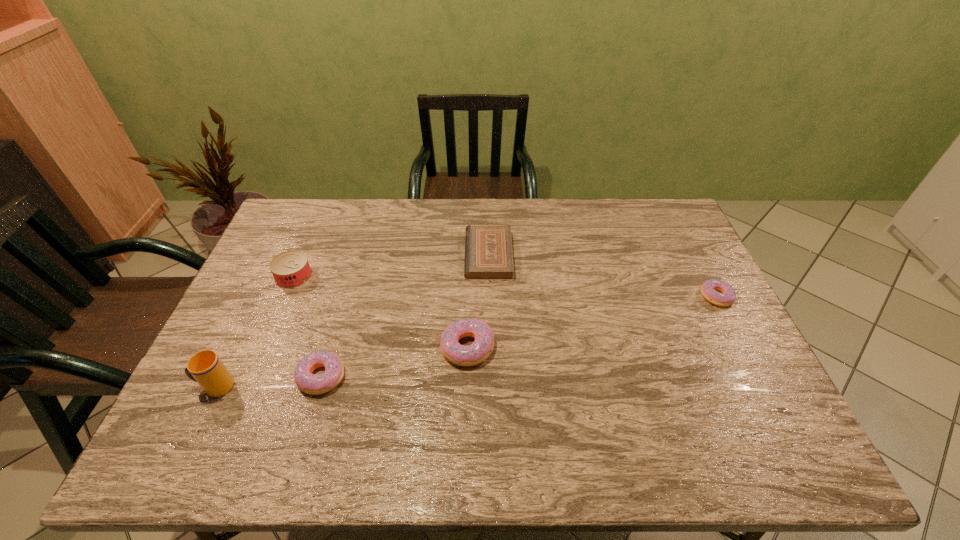
At what (x,y) coordinates should I click in order to perform the action: click on free spot between the can and the Bible. Please return your answer as a coordinate pair (x, y). Looking at the image, I should click on (392, 266).

I want to click on free space between the can and the rightmost object, so click(505, 286).

Identify the location of free area in between the tallest doughnut and the can. The height and width of the screenshot is (540, 960). click(x=381, y=312).

At what (x,y) coordinates should I click in order to perform the action: click on free point between the fourth object from right to left and the second doughnut from left to right. Please return your answer as a coordinate pair (x, y). This screenshot has width=960, height=540. Looking at the image, I should click on (395, 362).

Identify the location of unoccupied position between the tallest doughnut and the can. (381, 312).

Identify the location of unoccupied position between the Bible and the can. (392, 266).

This screenshot has height=540, width=960. In order to click on free space between the rightmost doughnut and the Bible in this screenshot , I will do `click(602, 276)`.

Where is `vacant area that lies between the second doughnut from left to right and the shortest doughnut`? vacant area that lies between the second doughnut from left to right and the shortest doughnut is located at coordinates (592, 322).

Point out which object is positioned as the nearest to the cup. Please provide its 2D coordinates. Your answer should be formatted as a tuple, i.e. [(x, y)], where the tuple contains the x and y coordinates of a point satisfying the conditions above.

[(314, 384)]

The image size is (960, 540). I want to click on the second closest object to the can, so 205,367.